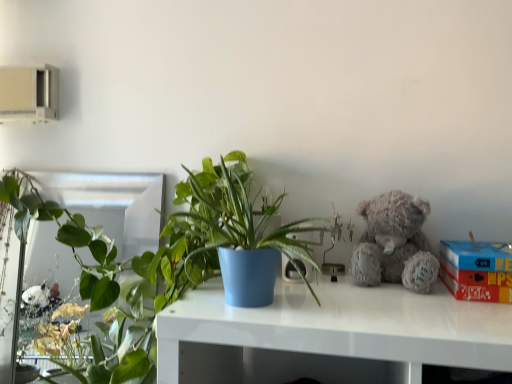
Image resolution: width=512 pixels, height=384 pixels. What do you see at coordinates (477, 270) in the screenshot? I see `red cardboard box at right` at bounding box center [477, 270].

This screenshot has width=512, height=384. Describe the element at coordinates (225, 223) in the screenshot. I see `matte blue pot at center, the 2th houseplant from the back` at that location.

Find the location of a particular element. fuzzy gray teddy bear at upper right is located at coordinates (394, 243).

Relative to red cardboard box at right, is fuzzy gray teddy bear at upper right in front or behind?

In the image, fuzzy gray teddy bear at upper right appears behind red cardboard box at right.

Consider the image. Is fuzzy gray teddy bear at upper right thinner than red cardboard box at right?

Yes, fuzzy gray teddy bear at upper right is thinner than red cardboard box at right.

Between fuzzy gray teddy bear at upper right and red cardboard box at right, which one has smaller size?

fuzzy gray teddy bear at upper right.

Is fuzzy gray teddy bear at upper right located outside red cardboard box at right?

Yes, fuzzy gray teddy bear at upper right is outside of red cardboard box at right.

Which of these two, green glossy plant at left, acting as the 1th houseplant starting from the left, or matte blue pot at center, the 2th houseplant from the back, is thinner?

With smaller width is green glossy plant at left, acting as the 1th houseplant starting from the left.

Between green glossy plant at left, acting as the 1th houseplant starting from the left, and matte blue pot at center, the 2th houseplant from the back, which one has larger size?

green glossy plant at left, acting as the 1th houseplant starting from the left.

In the scene shown: Between green glossy plant at left, the 2th houseplant from the right, and matte blue pot at center, which is counted as the second houseplant, starting from the left, which one appears on the left side from the viewer's perspective?

green glossy plant at left, the 2th houseplant from the right, is more to the left.

Which is nearer, (197, 219) or (120, 178)?

Point (197, 219).

Is matte blue pot at center, the 1th houseplant when ordered from right to left, wider or thinner than green glossy plant at left, acting as the 1th houseplant starting from the left?

Clearly, matte blue pot at center, the 1th houseplant when ordered from right to left, has more width compared to green glossy plant at left, acting as the 1th houseplant starting from the left.

Is matte blue pot at center, the 1th houseplant when ordered from right to left, positioned with its back to green glossy plant at left, the 2th houseplant from the right?

matte blue pot at center, the 1th houseplant when ordered from right to left, does not have its back to green glossy plant at left, the 2th houseplant from the right.

Is red cardboard box at right shorter than fuzzy gray teddy bear at upper right?

Correct, red cardboard box at right is not as tall as fuzzy gray teddy bear at upper right.

Is red cardboard box at right facing towards fuzzy gray teddy bear at upper right?

No, red cardboard box at right is not facing towards fuzzy gray teddy bear at upper right.

Is red cardboard box at right not near fuzzy gray teddy bear at upper right?

No, red cardboard box at right is not far from fuzzy gray teddy bear at upper right.

Is the depth of red cardboard box at right less than that of matte blue pot at center, which is counted as the second houseplant, starting from the left?

No.

Find the location of a particular element. box below the matte blue pot at center, which is counted as the second houseplant, starting from the left (from a real-world perspective) is located at coordinates (477, 270).

Is matte blue pot at center, the 2th houseplant from the back, inside red cardboard box at right?

Actually, matte blue pot at center, the 2th houseplant from the back, is outside red cardboard box at right.

From a real-world perspective, is red cardboard box at right above or below matte blue pot at center, the 1th houseplant when ordered from right to left?

red cardboard box at right is situated lower than matte blue pot at center, the 1th houseplant when ordered from right to left, in the real world.

Is fuzzy gray teddy bear at upper right directly adjacent to matte blue pot at center, acting as the first houseplant starting from the front?

They are not placed beside each other.

Considering their positions, is fuzzy gray teddy bear at upper right located in front of or behind matte blue pot at center, acting as the first houseplant starting from the front?

Clearly, fuzzy gray teddy bear at upper right is behind matte blue pot at center, acting as the first houseplant starting from the front.

Can you confirm if fuzzy gray teddy bear at upper right is thinner than matte blue pot at center, the 2th houseplant from the back?

Indeed, fuzzy gray teddy bear at upper right has a lesser width compared to matte blue pot at center, the 2th houseplant from the back.

From the picture: Choose the correct answer: Is fuzzy gray teddy bear at upper right inside matte blue pot at center, which is counted as the second houseplant, starting from the left, or outside it?

fuzzy gray teddy bear at upper right lies outside matte blue pot at center, which is counted as the second houseplant, starting from the left.

Looking at this image, is green glossy plant at left, which is counted as the second houseplant, starting from the front, behind red cardboard box at right?

That is True.

Between green glossy plant at left, which is counted as the second houseplant, starting from the front, and red cardboard box at right, which one has larger size?

green glossy plant at left, which is counted as the second houseplant, starting from the front, is bigger.

Are green glossy plant at left, which is counted as the second houseplant, starting from the front, and red cardboard box at right making contact?

No, green glossy plant at left, which is counted as the second houseplant, starting from the front, is not in contact with red cardboard box at right.

Considering the relative positions of green glossy plant at left, the 2th houseplant from the right, and red cardboard box at right in the image provided, is green glossy plant at left, the 2th houseplant from the right, to the right of red cardboard box at right from the viewer's perspective?

No.

Where is `box on the right of fuzzy gray teddy bear at upper right`? The width and height of the screenshot is (512, 384). box on the right of fuzzy gray teddy bear at upper right is located at coordinates (477, 270).

There is a green glossy plant at left, acting as the 1th houseplant starting from the left. Identify the location of houseplant above it (from a real-world perspective). This screenshot has height=384, width=512. (225, 223).

Considering their positions, is fuzzy gray teddy bear at upper right positioned further to red cardboard box at right than green glossy plant at left, which is counted as the second houseplant, starting from the front?

Among the two, green glossy plant at left, which is counted as the second houseplant, starting from the front, is located further to red cardboard box at right.

Based on their spatial positions, is red cardboard box at right or green glossy plant at left, which is counted as the second houseplant, starting from the front, further from matte blue pot at center, which is counted as the second houseplant, starting from the left?

red cardboard box at right.

Considering their positions, is fuzzy gray teddy bear at upper right positioned closer to red cardboard box at right than matte blue pot at center, acting as the first houseplant starting from the front?

fuzzy gray teddy bear at upper right lies closer to red cardboard box at right than the other object.

When comparing their distances from red cardboard box at right, does green glossy plant at left, the 2th houseplant from the right, or matte blue pot at center, the 2th houseplant from the back, seem further?

green glossy plant at left, the 2th houseplant from the right.

Estimate the real-world distances between objects in this image. Which object is closer to fuzzy gray teddy bear at upper right, green glossy plant at left, which is counted as the second houseplant, starting from the front, or matte blue pot at center, the 2th houseplant from the back?

matte blue pot at center, the 2th houseplant from the back, is positioned closer to the anchor fuzzy gray teddy bear at upper right.

Estimate the real-world distances between objects in this image. Which object is further from matte blue pot at center, the 1th houseplant when ordered from right to left, fuzzy gray teddy bear at upper right or green glossy plant at left, the 2th houseplant from the right?

green glossy plant at left, the 2th houseplant from the right, is positioned further to the anchor matte blue pot at center, the 1th houseplant when ordered from right to left.

Considering their positions, is red cardboard box at right positioned further to green glossy plant at left, which is counted as the second houseplant, starting from the front, than fuzzy gray teddy bear at upper right?

red cardboard box at right is further to green glossy plant at left, which is counted as the second houseplant, starting from the front.

From the image, which object appears to be farther from red cardboard box at right, matte blue pot at center, the 1th houseplant when ordered from right to left, or green glossy plant at left, which is counted as the second houseplant, starting from the front?

green glossy plant at left, which is counted as the second houseplant, starting from the front.

Find the location of `teddy bear between green glossy plant at left, acting as the 1th houseplant starting from the left, and red cardboard box at right`. teddy bear between green glossy plant at left, acting as the 1th houseplant starting from the left, and red cardboard box at right is located at coordinates (394, 243).

The width and height of the screenshot is (512, 384). In order to click on houseplant between green glossy plant at left, acting as the 1th houseplant starting from the left, and fuzzy gray teddy bear at upper right in this screenshot , I will do `click(225, 223)`.

At what (x,y) coordinates should I click in order to perform the action: click on teddy bear between matte blue pot at center, acting as the first houseplant starting from the front, and red cardboard box at right. Please return your answer as a coordinate pair (x, y). The image size is (512, 384). Looking at the image, I should click on (394, 243).

Where is `houseplant between green glossy plant at left, which is counted as the second houseplant, starting from the front, and red cardboard box at right`? The image size is (512, 384). houseplant between green glossy plant at left, which is counted as the second houseplant, starting from the front, and red cardboard box at right is located at coordinates (225, 223).